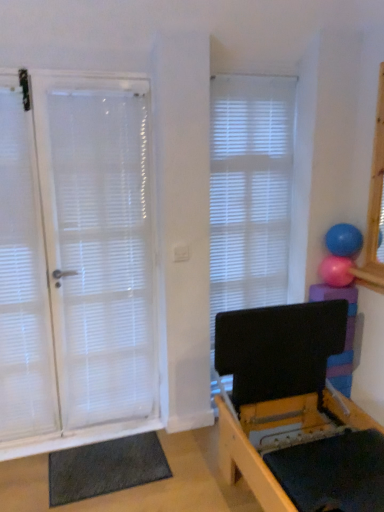
Question: Considering the relative positions of white matte window blind at center and dark gray textured yoga mat at lower left in the image provided, is white matte window blind at center to the right of dark gray textured yoga mat at lower left from the viewer's perspective?

Choices:
 (A) no
 (B) yes

Answer: (B)

Question: Is white matte window blind at center taller than dark gray textured yoga mat at lower left?

Choices:
 (A) yes
 (B) no

Answer: (A)

Question: Can you confirm if white matte window blind at center is thinner than dark gray textured yoga mat at lower left?

Choices:
 (A) no
 (B) yes

Answer: (B)

Question: From a real-world perspective, is white matte window blind at center over dark gray textured yoga mat at lower left?

Choices:
 (A) yes
 (B) no

Answer: (A)

Question: From the image's perspective, is white matte window blind at center above dark gray textured yoga mat at lower left?

Choices:
 (A) yes
 (B) no

Answer: (A)

Question: Which is correct: dark gray textured yoga mat at lower left is inside white matte window blind at center, or outside of it?

Choices:
 (A) outside
 (B) inside

Answer: (A)

Question: Is point (79, 453) closer or farther from the camera than point (226, 242)?

Choices:
 (A) closer
 (B) farther

Answer: (A)

Question: From the image's perspective, relative to white matte window blind at center, is dark gray textured yoga mat at lower left above or below?

Choices:
 (A) above
 (B) below

Answer: (B)

Question: From a real-world perspective, is dark gray textured yoga mat at lower left positioned above or below white matte window blind at center?

Choices:
 (A) below
 (B) above

Answer: (A)

Question: Based on their positions, is white sheer curtain at left located to the left or right of dark gray textured yoga mat at lower left?

Choices:
 (A) right
 (B) left

Answer: (B)

Question: Considering the positions of point (6, 286) and point (132, 480), is point (6, 286) closer or farther from the camera than point (132, 480)?

Choices:
 (A) farther
 (B) closer

Answer: (A)

Question: In terms of size, does white sheer curtain at left appear bigger or smaller than dark gray textured yoga mat at lower left?

Choices:
 (A) big
 (B) small

Answer: (A)

Question: Relative to dark gray textured yoga mat at lower left, is white sheer curtain at left in front or behind?

Choices:
 (A) front
 (B) behind

Answer: (A)

Question: Is point (46, 406) positioned closer to the camera than point (345, 275)?

Choices:
 (A) closer
 (B) farther

Answer: (B)

Question: Looking at the image, does white sheer curtain at left seem bigger or smaller compared to pink rubber ball at upper right, which is the 2th ball in top-to-bottom order?

Choices:
 (A) big
 (B) small

Answer: (A)